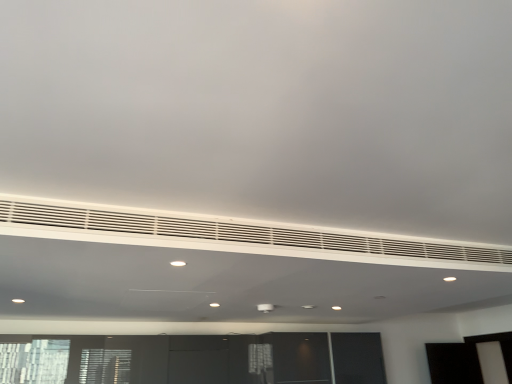
What is the approximate height of white matte air conditioning at center?

It is 14.16 centimeters.

The width and height of the screenshot is (512, 384). Find the location of `white matte air conditioning at center`. white matte air conditioning at center is located at coordinates (238, 235).

Image resolution: width=512 pixels, height=384 pixels. Describe the element at coordinates (238, 235) in the screenshot. I see `white matte air conditioning at center` at that location.

Measure the distance between white matte vent at center and camera.

white matte vent at center and camera are 5.47 feet apart from each other.

What is the approximate width of white matte vent at center?

white matte vent at center is 2.86 meters in width.

Locate an element on the screen. This screenshot has height=384, width=512. white matte vent at center is located at coordinates (241, 278).

What do you see at coordinates (241, 278) in the screenshot?
I see `white matte vent at center` at bounding box center [241, 278].

What are the coordinates of `white matte air conditioning at center` in the screenshot? It's located at (238, 235).

Is white matte vent at center at the left side of white matte air conditioning at center?

Indeed, white matte vent at center is positioned on the left side of white matte air conditioning at center.

Considering the relative positions of white matte vent at center and white matte air conditioning at center in the image provided, is white matte vent at center in front of white matte air conditioning at center?

Yes.

Is point (1, 289) positioned in front of point (442, 267)?

No, (1, 289) is behind (442, 267).

From the image's perspective, would you say white matte vent at center is shown under white matte air conditioning at center?

Correct, white matte vent at center appears lower than white matte air conditioning at center in the image.

From a real-world perspective, relative to white matte air conditioning at center, is white matte vent at center vertically above or below?

Clearly, from a real-world perspective, white matte vent at center is below white matte air conditioning at center.

In the scene shown: Considering the sizes of objects white matte vent at center and white matte air conditioning at center in the image provided, who is thinner, white matte vent at center or white matte air conditioning at center?

Thinner between the two is white matte air conditioning at center.

Between white matte vent at center and white matte air conditioning at center, which one has less height?

white matte vent at center is shorter.

Which of these two, white matte vent at center or white matte air conditioning at center, is bigger?

With larger size is white matte vent at center.

Would you say white matte vent at center is outside white matte air conditioning at center?

white matte vent at center is positioned outside white matte air conditioning at center.

Is white matte vent at center next to white matte air conditioning at center?

white matte vent at center and white matte air conditioning at center are clearly separated.

Does white matte vent at center turn towards white matte air conditioning at center?

No, white matte vent at center is not turned towards white matte air conditioning at center.

I want to click on air conditioning behind the white matte vent at center, so click(x=238, y=235).

Is white matte air conditioning at center to the left of white matte vent at center from the viewer's perspective?

No.

Which object is closer to the camera, white matte air conditioning at center or white matte vent at center?

white matte vent at center is more forward.

Which is closer, (201,240) or (348,301)?

Point (201,240).

From the image's perspective, which is above, white matte air conditioning at center or white matte vent at center?

From the image's view, white matte air conditioning at center is above.

From a real-world perspective, does white matte air conditioning at center sit lower than white matte vent at center?

No.

From the picture: In terms of width, does white matte air conditioning at center look wider or thinner when compared to white matte vent at center?

Considering their sizes, white matte air conditioning at center looks slimmer than white matte vent at center.

Who is taller, white matte air conditioning at center or white matte vent at center?

white matte air conditioning at center is taller.

Looking at the image, does white matte air conditioning at center seem bigger or smaller compared to white matte vent at center?

Clearly, white matte air conditioning at center is smaller in size than white matte vent at center.

Is white matte air conditioning at center spatially inside white matte vent at center, or outside of it?

white matte air conditioning at center is outside white matte vent at center.

From the picture: Is white matte air conditioning at center directly adjacent to white matte vent at center?

No, white matte air conditioning at center is not touching white matte vent at center.

Is white matte air conditioning at center positioned with its back to white matte vent at center?

No.

Can you tell me how much white matte air conditioning at center and white matte vent at center differ in facing direction?

180 degrees.

Measure the distance between white matte air conditioning at center and white matte vent at center.

They are 29.45 inches apart.

Locate an element on the screen. entertainment center in front of the white matte air conditioning at center is located at coordinates (241, 278).

This screenshot has height=384, width=512. Identify the location of air conditioning that appears on the right of white matte vent at center. (238, 235).

Locate an element on the screen. Image resolution: width=512 pixels, height=384 pixels. entertainment center below the white matte air conditioning at center (from a real-world perspective) is located at coordinates (241, 278).